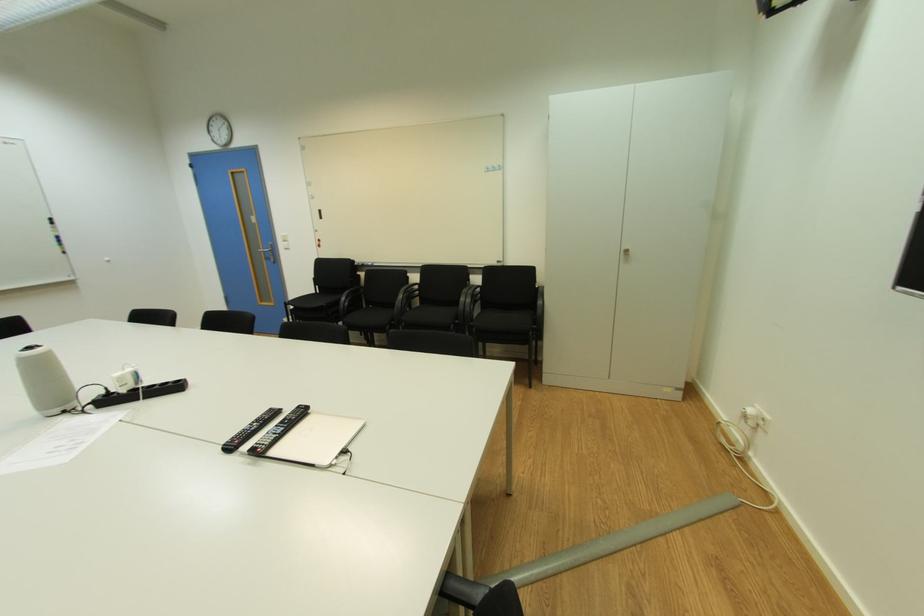
Find the location of `black chair armrest`. black chair armrest is located at coordinates (460, 585).